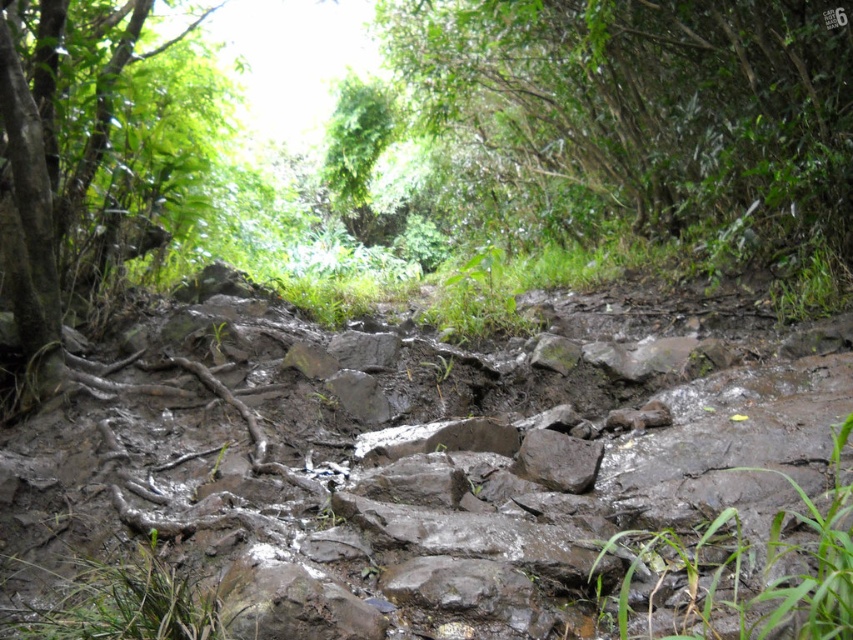
Question: Which object appears farthest from the camera in this image?

Choices:
 (A) brown rough tree roots at left
 (B) green leafy tree at upper center

Answer: (B)

Question: Does green leafy tree at upper center have a larger size compared to brown rough tree roots at left?

Choices:
 (A) yes
 (B) no

Answer: (A)

Question: Which object is closer to the camera taking this photo?

Choices:
 (A) brown rough tree roots at left
 (B) green leafy tree at upper center

Answer: (A)

Question: Among these objects, which one is farthest from the camera?

Choices:
 (A) green leafy tree at upper center
 (B) brown rough tree roots at left

Answer: (A)

Question: Is green leafy tree at upper center above brown rough tree roots at left?

Choices:
 (A) no
 (B) yes

Answer: (B)

Question: Is green leafy tree at upper center below brown rough tree roots at left?

Choices:
 (A) yes
 (B) no

Answer: (B)